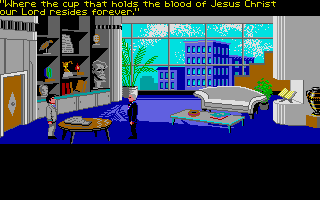
Where is `door`? This screenshot has height=200, width=320. door is located at coordinates (14, 115).